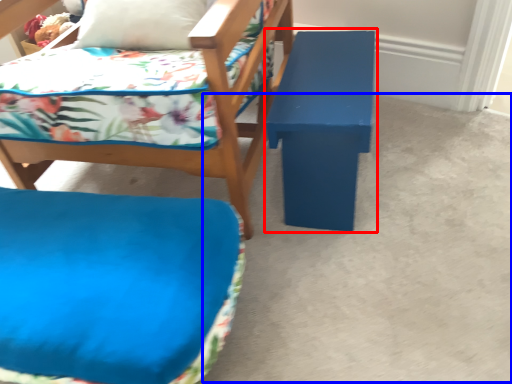
Question: Which object appears closest to the camera in this image, table (highlighted by a red box) or concrete (highlighted by a blue box)?

Choices:
 (A) table
 (B) concrete

Answer: (B)